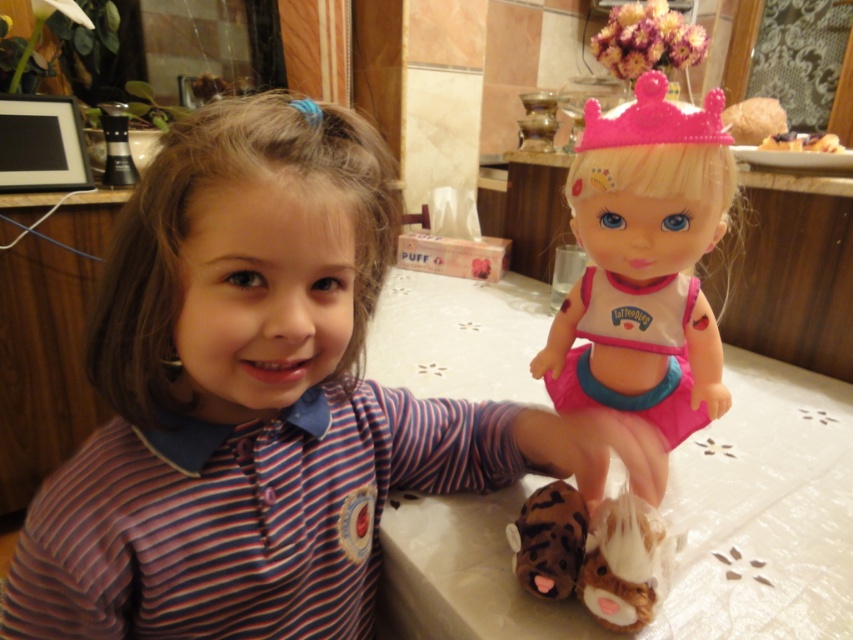
Question: Does striped fabric child at center have a greater width compared to pink plastic doll at center?

Choices:
 (A) no
 (B) yes

Answer: (B)

Question: Is striped fabric child at center thinner than white lace tablecloth at center?

Choices:
 (A) yes
 (B) no

Answer: (A)

Question: Which object appears closest to the camera in this image?

Choices:
 (A) brown plush toy at lower center
 (B) pink plastic doll at center

Answer: (B)

Question: Which point appears farthest from the camera in this image?

Choices:
 (A) (579, 528)
 (B) (161, 268)

Answer: (A)

Question: Among these points, which one is nearest to the camera?

Choices:
 (A) (520, 579)
 (B) (566, 513)
 (C) (587, 292)
 (D) (381, 365)

Answer: (A)

Question: From the image, what is the correct spatial relationship of pink plastic doll at center in relation to brown plush toy at lower center?

Choices:
 (A) below
 (B) above

Answer: (B)